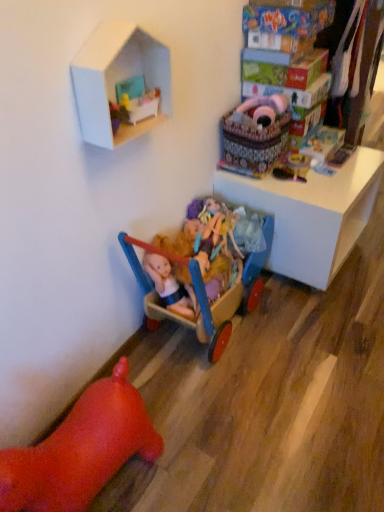
The height and width of the screenshot is (512, 384). What are the coordinates of `vacant space in front of wooden wagon at lower center, which is the 5th toy in right-to-left order` in the screenshot? It's located at (250, 420).